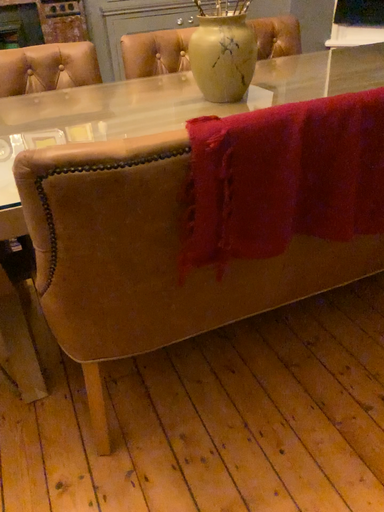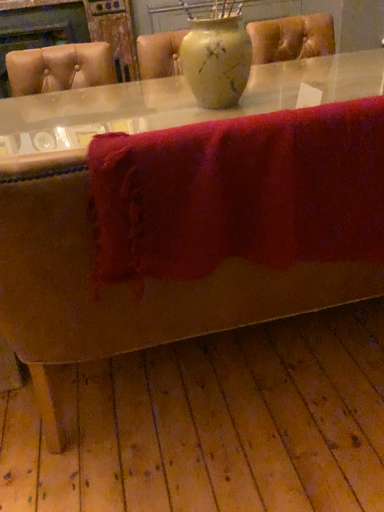
Question: How did the camera likely rotate when shooting the video?

Choices:
 (A) rotated right
 (B) rotated left

Answer: (B)